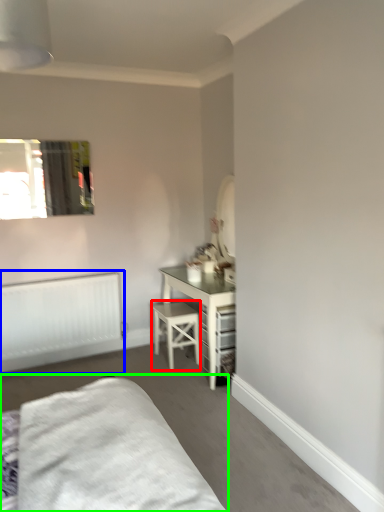
Question: Which object is positioned closest to stool (highlighted by a red box)? Select from radiator (highlighted by a blue box) and bed (highlighted by a green box).

Choices:
 (A) radiator
 (B) bed

Answer: (A)